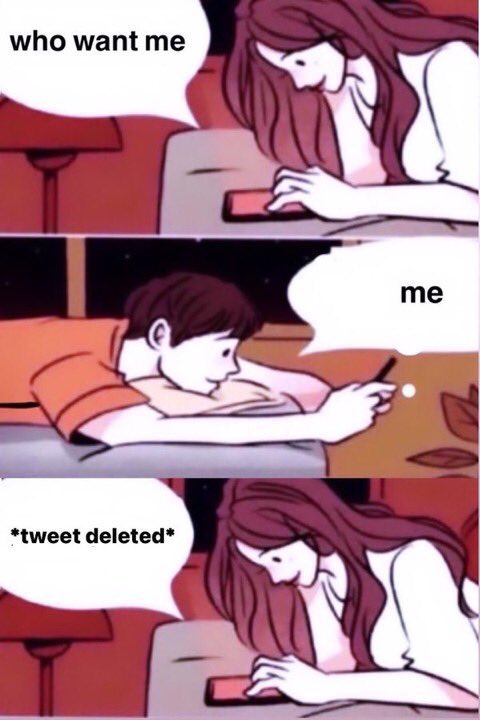
Identify the location of bed pillow. This screenshot has width=480, height=720. pos(232,400).